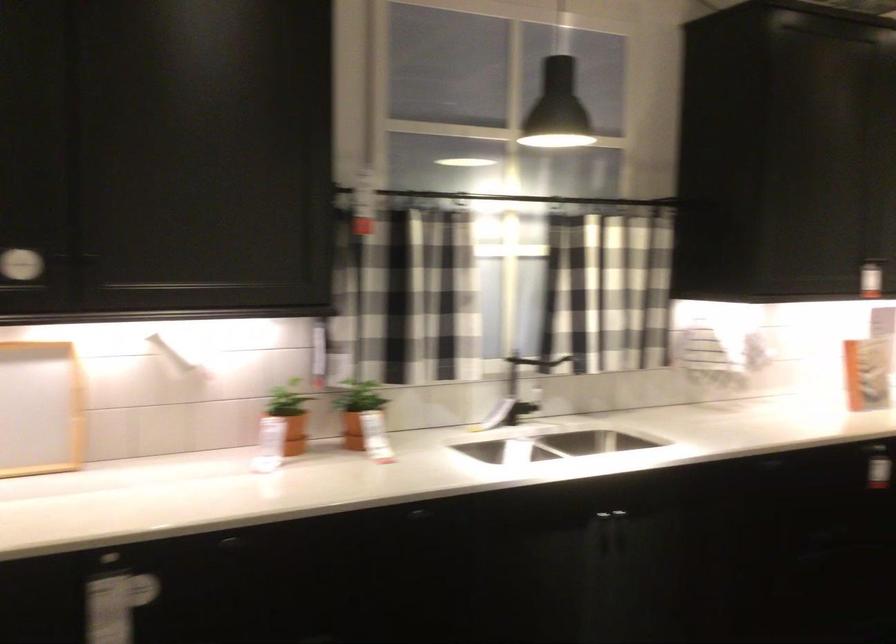
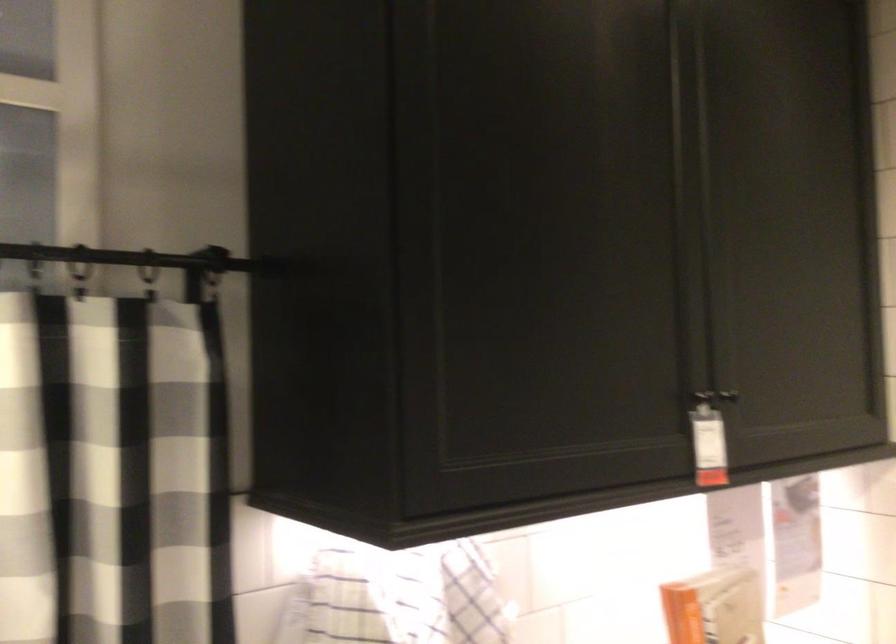
Which direction would the cameraman need to move to produce the second image?

The cameraman walked toward right, forward.